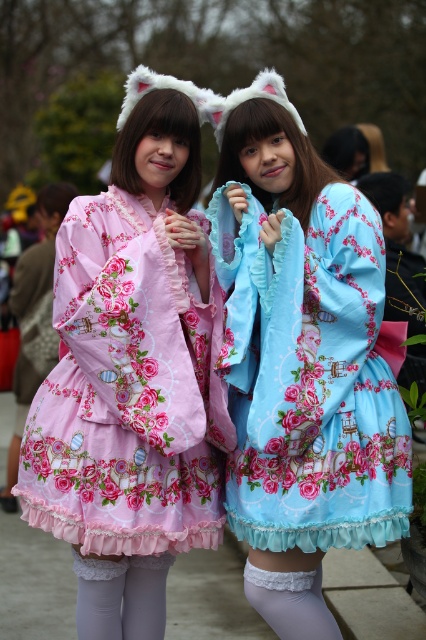
Question: Among these points, which one is farthest from the camera?

Choices:
 (A) (276, 106)
 (B) (158, 252)

Answer: (A)

Question: Is blue satin dress at center further to camera compared to pink floral fabric dress at center?

Choices:
 (A) no
 (B) yes

Answer: (A)

Question: Among these points, which one is farthest from the camera?

Choices:
 (A) (178, 390)
 (B) (83, 557)
 (C) (273, 596)

Answer: (B)

Question: Among these points, which one is nearest to the camera?

Choices:
 (A) (92, 625)
 (B) (262, 577)

Answer: (B)

Question: Does pink floral fabric dress at center appear on the left side of white lace tights at lower center?

Choices:
 (A) yes
 (B) no

Answer: (A)

Question: Can you confirm if blue satin dress at center is wider than pink floral fabric dress at center?

Choices:
 (A) yes
 (B) no

Answer: (B)